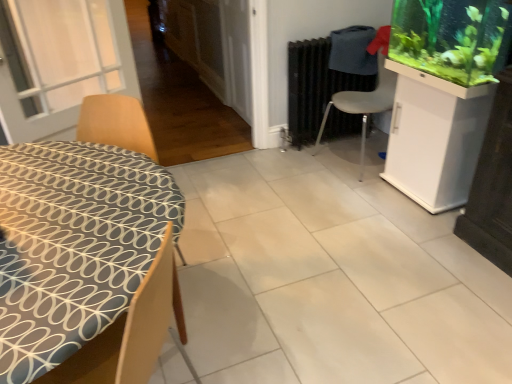
Locate an element on the screen. Image resolution: width=512 pixels, height=384 pixels. space that is in front of white plastic chair at center-right, placed as the second chair when sorted from left to right is located at coordinates (360, 190).